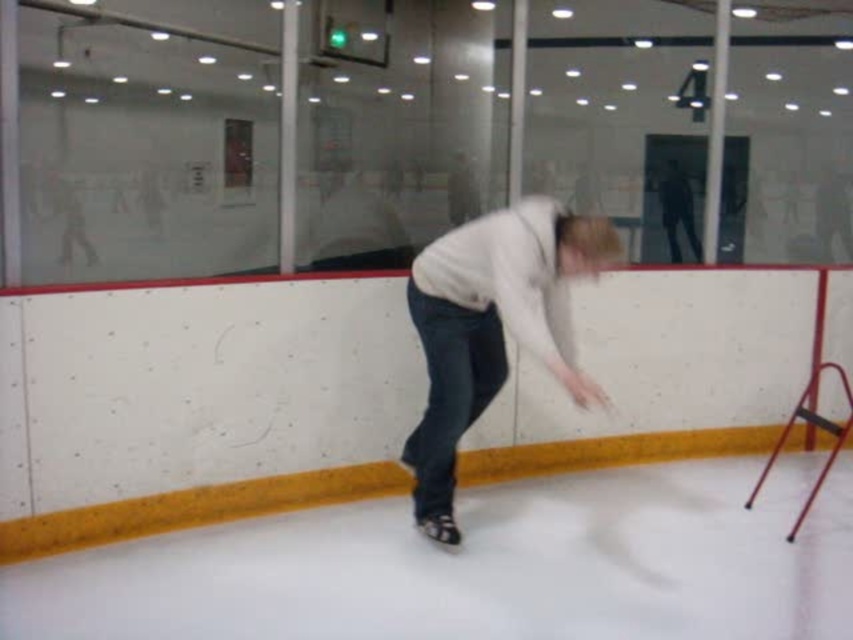
Question: Observing the image, what is the correct spatial positioning of white smooth ice at lower center in reference to white matte sweater at center?

Choices:
 (A) right
 (B) left

Answer: (A)

Question: From the image, what is the correct spatial relationship of white smooth ice at lower center in relation to white matte sweater at center?

Choices:
 (A) above
 (B) below

Answer: (B)

Question: Among these objects, which one is farthest from the camera?

Choices:
 (A) white matte sweater at center
 (B) white smooth ice at lower center

Answer: (A)

Question: Is white smooth ice at lower center to the left of white matte sweater at center from the viewer's perspective?

Choices:
 (A) yes
 (B) no

Answer: (B)